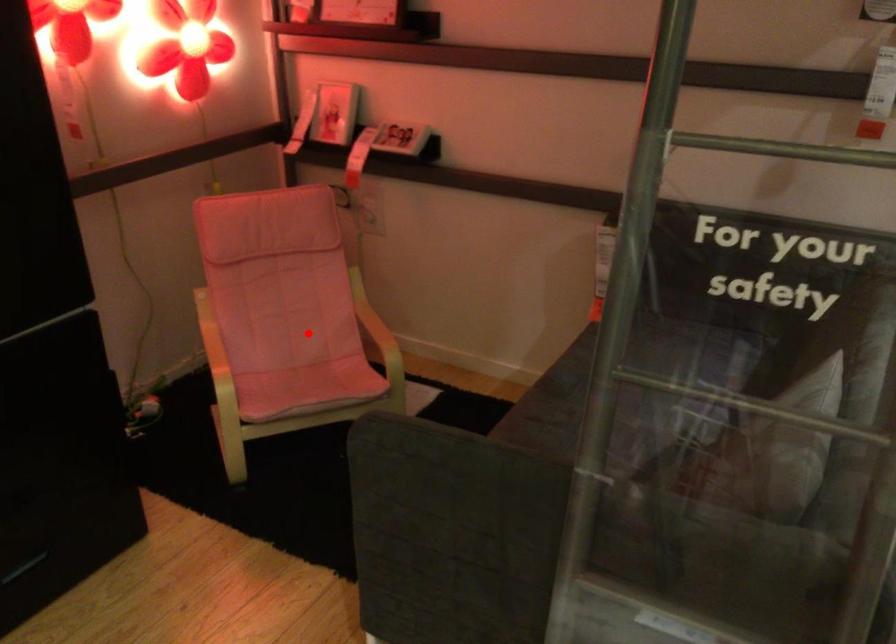
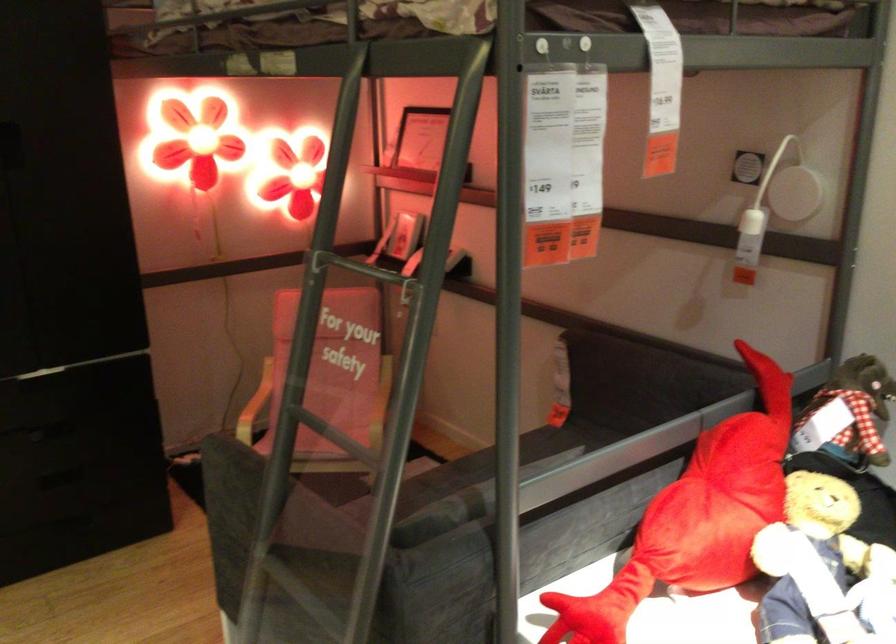
Question: I am providing you with two images of the same scene from different viewpoints. Given a red point in image1, look at the same physical point in image2. Is it:

Choices:
 (A) Closer to the viewpoint
 (B) Farther from the viewpoint

Answer: (B)